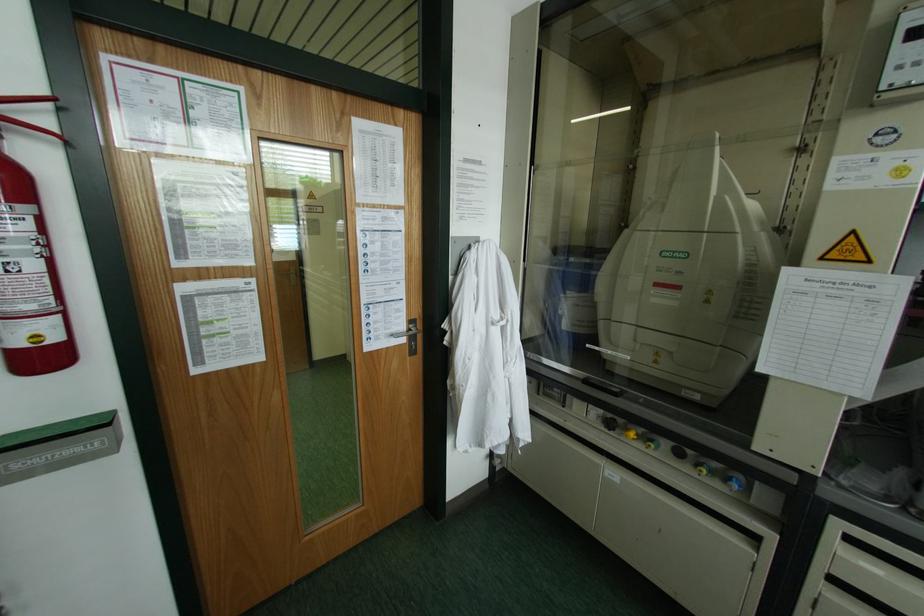
Find where to turn the blue control knob. Please return your answer as a coordinate pair (x, y).

(734, 480)